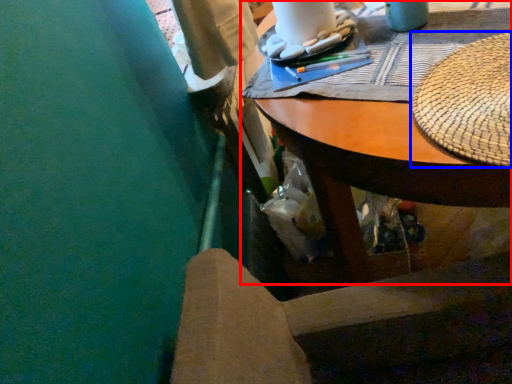
Question: Among these objects, which one is farthest to the camera, desk (highlighted by a red box) or hat (highlighted by a blue box)?

Choices:
 (A) desk
 (B) hat

Answer: (B)